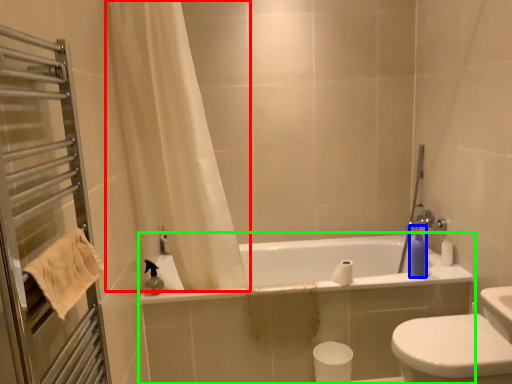
Question: Which is nearer to the curtain (highlighted by a red box)? soap dispenser (highlighted by a blue box) or bathtub (highlighted by a green box).

Choices:
 (A) soap dispenser
 (B) bathtub

Answer: (B)